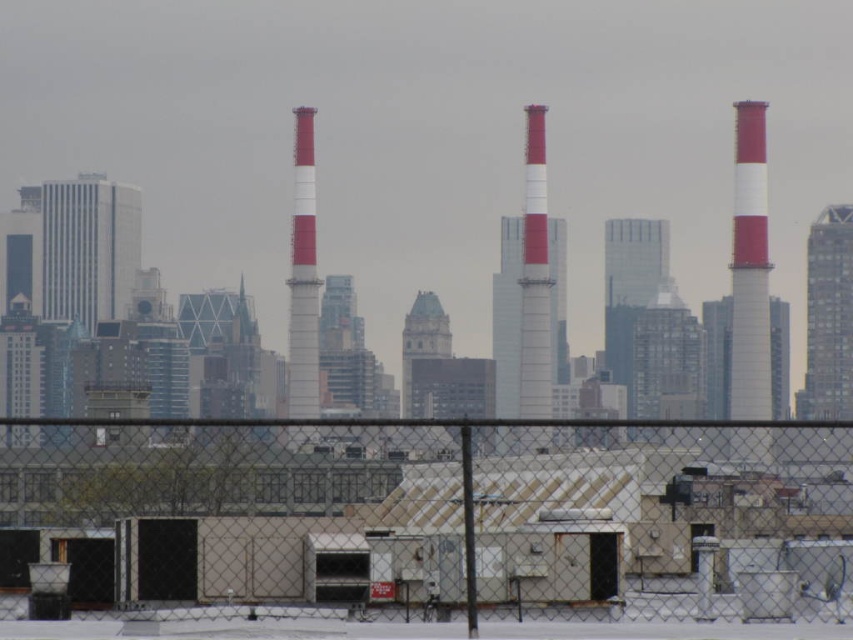
Which is more to the left, chain link fence at lower center or white smooth chimneys at center?

Positioned to the left is chain link fence at lower center.

Which is behind, point (305, 529) or point (514, 438)?

The point (514, 438) is more distant.

Does point (637, 493) come farther from viewer compared to point (740, 460)?

No, it is not.

Identify the location of chain link fence at lower center. This screenshot has width=853, height=640. (436, 515).

Does white smooth chimneys at center appear under white striped chimney at center?

Result: Yes.

Does point (445, 442) come behind point (538, 365)?

That is False.

Does point (784, 426) lie in front of point (527, 428)?

No, (784, 426) is further to viewer.

Where is `white smooth chimneys at center`? white smooth chimneys at center is located at coordinates (428, 435).

Is white smooth chimneys at center positioned in front of white painted metal chimney at center?

No.

Does white smooth chimneys at center have a larger size compared to white painted metal chimney at center?

Correct, white smooth chimneys at center is larger in size than white painted metal chimney at center.

Between point (312, 428) and point (299, 435), which one is positioned in front?

Point (299, 435) is more forward.

Image resolution: width=853 pixels, height=640 pixels. In order to click on white smooth chimneys at center in this screenshot , I will do `click(428, 435)`.